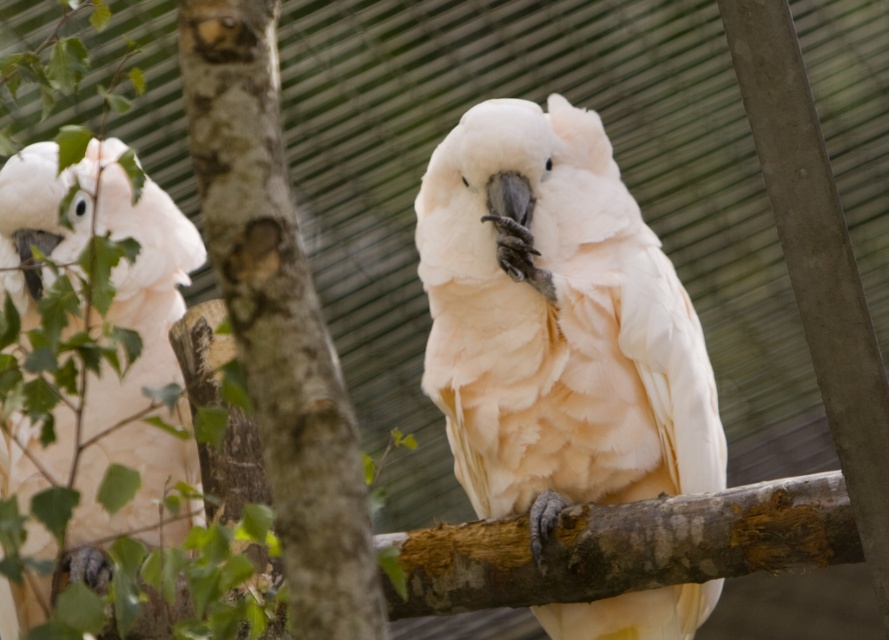
Question: Does white feathered parrot at center have a larger size compared to white feathered parrot at left?

Choices:
 (A) no
 (B) yes

Answer: (A)

Question: Which point is closer to the camera?

Choices:
 (A) [x=82, y=557]
 (B) [x=687, y=600]

Answer: (B)

Question: Can you confirm if white feathered parrot at center is smaller than white feathered parrot at left?

Choices:
 (A) no
 (B) yes

Answer: (B)

Question: Which point is farther from the camera taking this photo?

Choices:
 (A) 31,595
 (B) 495,180

Answer: (A)

Question: Is white feathered parrot at center to the right of white feathered parrot at left from the viewer's perspective?

Choices:
 (A) yes
 (B) no

Answer: (A)